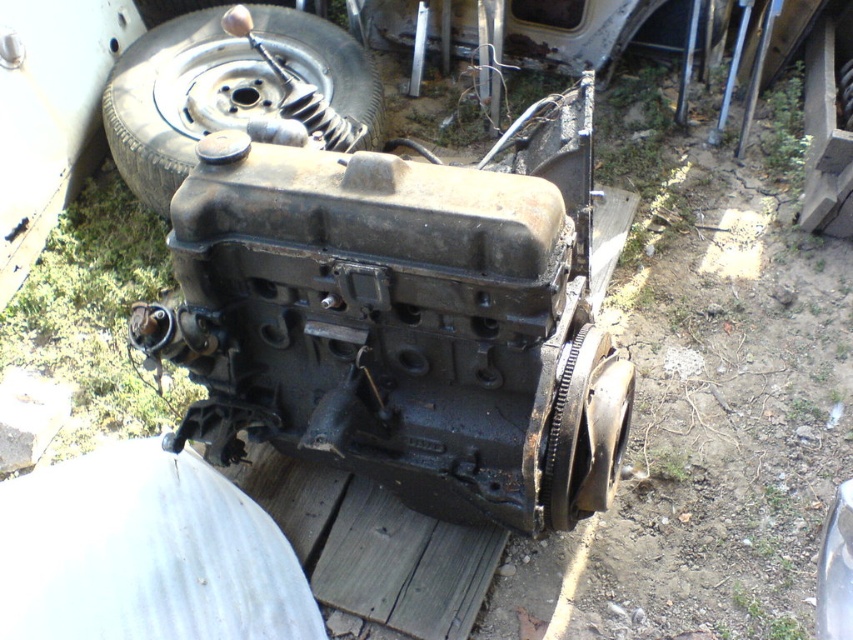
Question: Is rusty metal engine at center thinner than black rubber tire at upper left?

Choices:
 (A) no
 (B) yes

Answer: (A)

Question: Which object appears closest to the camera in this image?

Choices:
 (A) rusty metal engine at center
 (B) black rubber tire at upper left

Answer: (A)

Question: Is rusty metal engine at center bigger than black rubber tire at upper left?

Choices:
 (A) yes
 (B) no

Answer: (B)

Question: Can you confirm if rusty metal engine at center is bigger than black rubber tire at upper left?

Choices:
 (A) yes
 (B) no

Answer: (B)